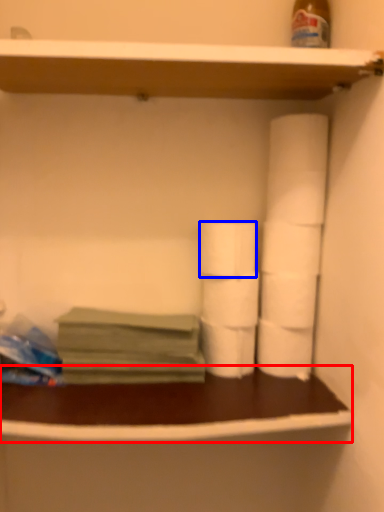
Question: Which of the following is the closest to the observer, counter (highlighted by a red box) or toilet paper (highlighted by a blue box)?

Choices:
 (A) counter
 (B) toilet paper

Answer: (A)